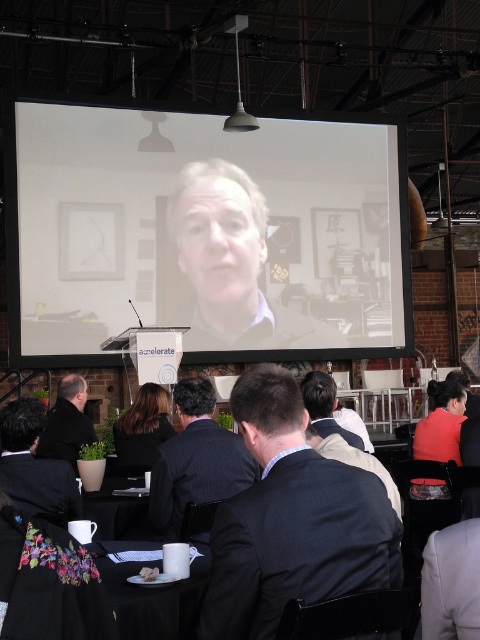
You are an event planner setting up the venue. You need to ensure that the white matte projection screen at center is visible to all attendees. Considering the white matte table at lower center, which object is taller and might block the view if placed too close?

The white matte projection screen at center is taller than the white matte table at lower center. Therefore, the projection screen is taller and could potentially block the view if positioned too close to the attendees, but since it is the screen meant for projection, its height is necessary. The table is shorter and less likely to obstruct unless stacked with items.

You are an event organizer setting up a live stream for the conference. The camera you have is 33.38 feet away from the white matte projection screen at center. Is the camera positioned at the recommended distance for optimal video quality?

The camera is exactly 33.38 feet away from the white matte projection screen at center, which matches the recommended distance for optimal video quality.

You are organizing a presentation and need to decide where to place your laptop. The laptop requires a surface at least as large as the white matte table at lower center. Is the white matte projection screen at center a suitable surface for placing the laptop?

The white matte projection screen at center has a larger size compared to the white matte table at lower center. Therefore, the screen is large enough to accommodate the laptop.